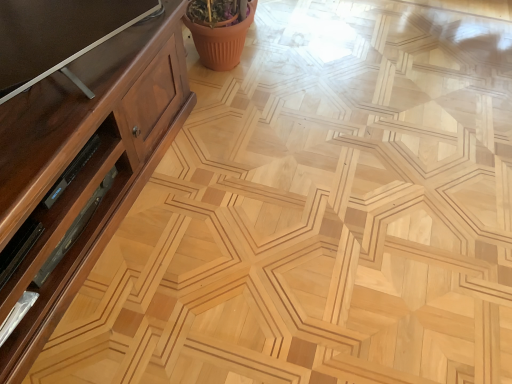
What are the coordinates of `dark wood cabinet at left` in the screenshot? It's located at [x=82, y=170].

What do you see at coordinates (82, 170) in the screenshot? The image size is (512, 384). I see `dark wood cabinet at left` at bounding box center [82, 170].

Find the location of a particular element. The image size is (512, 384). dark wood cabinet at left is located at coordinates (82, 170).